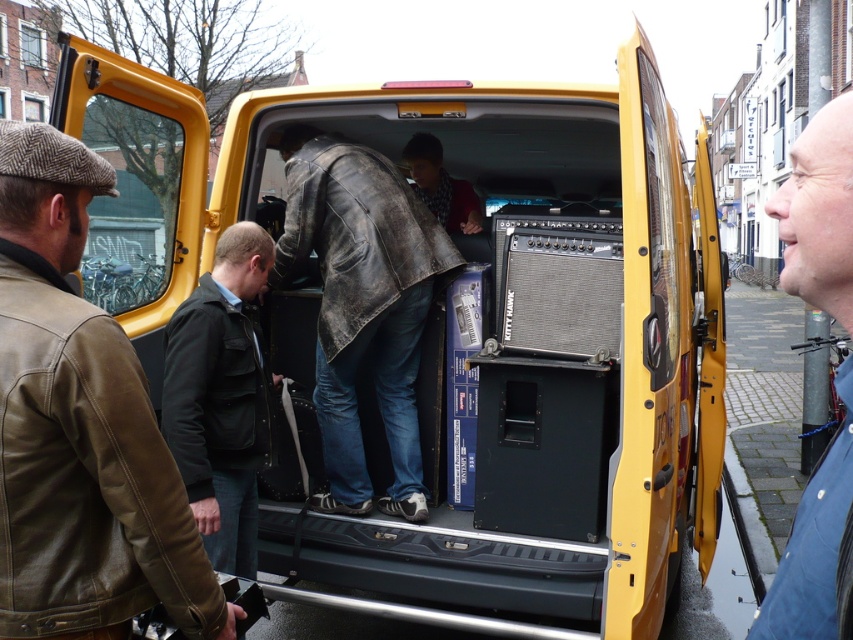
You are a delivery person who needs to load a large package into the van. The package requires a space that is at least as big as the blue denim jacket at lower right. Can you use the area currently occupied by the black leather jacket at center?

The black leather jacket at center occupies less space than the blue denim jacket at lower right. Therefore, the space taken by the black leather jacket at center is not sufficient to accommodate the package that requires the minimum space of the blue denim jacket at lower right. You will need to find another area in the van that can provide enough space.

You are standing in front of the yellow van with the two jackets mentioned. If you want to hand a tool to both the person wearing the leather jacket at center and the blue denim jacket at lower right, which jacket would you approach first to ensure you can reach them without moving around the van?

You should approach the leather jacket at center first because it is closer to you than the blue denim jacket at lower right, so you can reach them without needing to move around the van.

You are standing 5 feet away from the van and want to reach the point marked at coordinates point (39, 275). Can you reach it without moving closer?

The distance of point (39, 275) from viewer is 5.46 feet, so you are currently 5 feet away. Since 5.46 feet is slightly further than 5 feet, you need to move 0.46 feet closer to reach it.